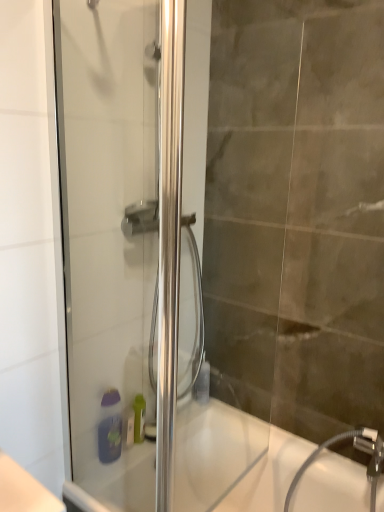
Question: From the image's perspective, is purple matte soap dispenser at lower center on top of white glossy bathtub at lower center?

Choices:
 (A) yes
 (B) no

Answer: (A)

Question: Is purple matte soap dispenser at lower center wider than white glossy bathtub at lower center?

Choices:
 (A) yes
 (B) no

Answer: (B)

Question: From the image's perspective, is purple matte soap dispenser at lower center located beneath white glossy bathtub at lower center?

Choices:
 (A) no
 (B) yes

Answer: (A)

Question: Is purple matte soap dispenser at lower center located outside white glossy bathtub at lower center?

Choices:
 (A) yes
 (B) no

Answer: (A)

Question: Is purple matte soap dispenser at lower center to the left of white glossy bathtub at lower center from the viewer's perspective?

Choices:
 (A) no
 (B) yes

Answer: (B)

Question: Looking at the image, does white glossy bathtub at lower center seem bigger or smaller compared to translucent plastic bottle at lower center?

Choices:
 (A) small
 (B) big

Answer: (B)

Question: Is white glossy bathtub at lower center wider or thinner than translucent plastic bottle at lower center?

Choices:
 (A) wide
 (B) thin

Answer: (A)

Question: From the image's perspective, is white glossy bathtub at lower center positioned above or below translucent plastic bottle at lower center?

Choices:
 (A) below
 (B) above

Answer: (A)

Question: From their relative heights in the image, would you say white glossy bathtub at lower center is taller or shorter than translucent plastic bottle at lower center?

Choices:
 (A) short
 (B) tall

Answer: (B)

Question: From a real-world perspective, relative to purple matte soap dispenser at lower center, is white glossy bathtub at lower center vertically above or below?

Choices:
 (A) below
 (B) above

Answer: (A)

Question: In the image, is white glossy bathtub at lower center on the left side or the right side of purple matte soap dispenser at lower center?

Choices:
 (A) left
 (B) right

Answer: (B)

Question: Choose the correct answer: Is white glossy bathtub at lower center inside purple matte soap dispenser at lower center or outside it?

Choices:
 (A) inside
 (B) outside

Answer: (B)

Question: Based on their sizes in the image, would you say white glossy bathtub at lower center is bigger or smaller than purple matte soap dispenser at lower center?

Choices:
 (A) big
 (B) small

Answer: (A)

Question: Considering the positions of point (178, 507) and point (122, 345), is point (178, 507) closer or farther from the camera than point (122, 345)?

Choices:
 (A) closer
 (B) farther

Answer: (B)

Question: Considering their positions, is white glossy bathtub at lower center located in front of or behind clear glass shower door at left?

Choices:
 (A) front
 (B) behind

Answer: (B)